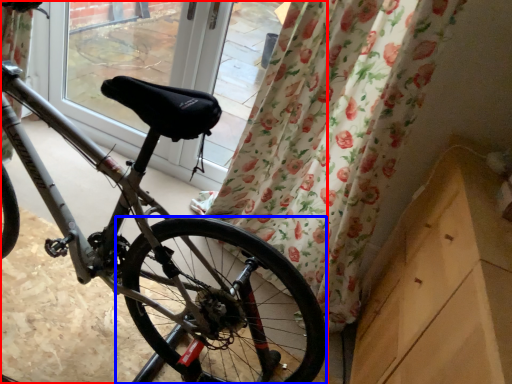
Question: Among these objects, which one is farthest to the camera, bicycle (highlighted by a red box) or wheel (highlighted by a blue box)?

Choices:
 (A) bicycle
 (B) wheel

Answer: (B)